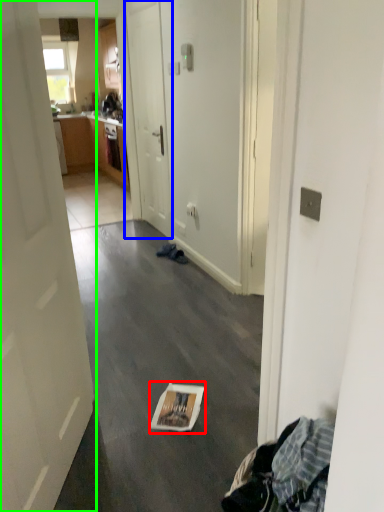
Question: Which object is positioned farthest from magazine (highlighted by a red box)? Select from door (highlighted by a blue box) and door (highlighted by a green box).

Choices:
 (A) door
 (B) door

Answer: (A)